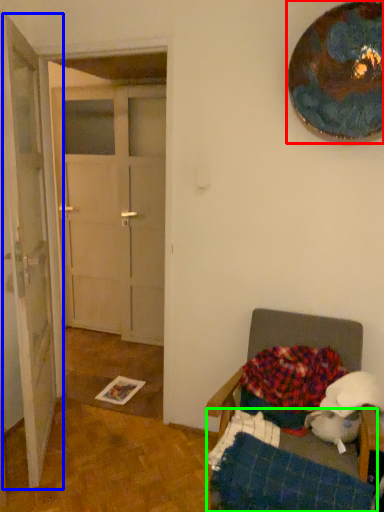
Question: Based on their relative distances, which object is farther from oval (highlighted by a red box)? Choose from door (highlighted by a blue box) and bed frame (highlighted by a green box).

Choices:
 (A) door
 (B) bed frame

Answer: (B)